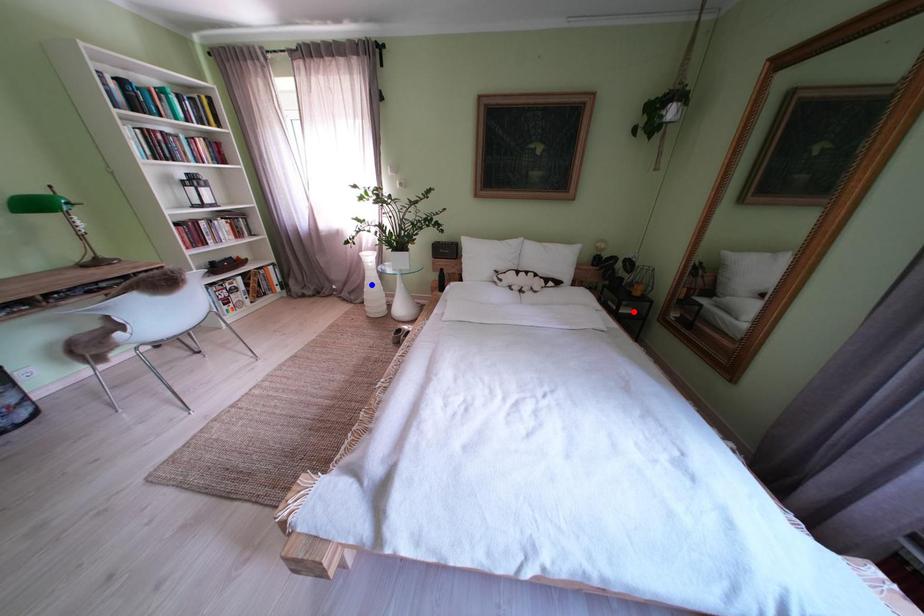
Question: Which of the two points in the image is closer to the camera?

Choices:
 (A) Blue point is closer.
 (B) Red point is closer.

Answer: (B)